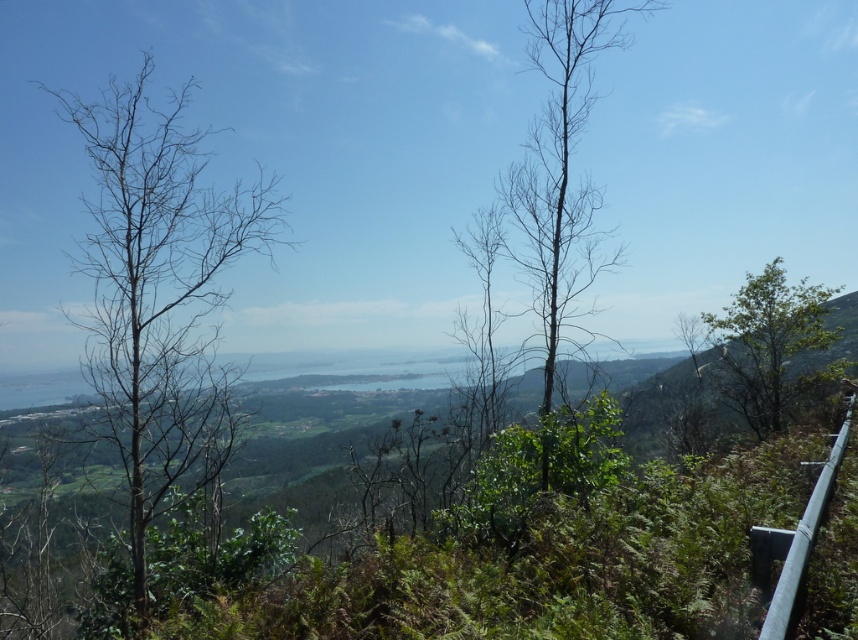
In the scene shown: You are standing at the vantage point and want to walk towards the silver metallic rail at right. Is the green leafy tree at right blocking your path?

The silver metallic rail at right is behind the green leafy tree at right, so the tree is blocking the path to the rail.

In the image, there is a point marked at coordinates (560,168). Which object from the scene does this point correspond to?

The point at coordinates (560,168) corresponds to the bare wood tree at center.

You are standing at the vantage point and want to take a photo of the green leafy tree at right and the silver metallic rail at right. Which object will appear wider in the photo?

The green leafy tree at right will appear wider in the photo because its width is larger than the silver metallic rail at right.